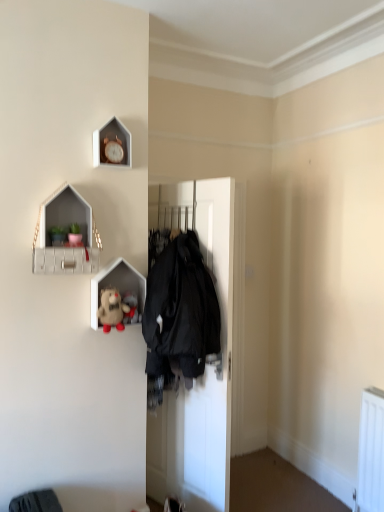
Question: Does fluffy beige teddy bear at upper left, the 2th toy from the back, have a lesser width compared to matte white plush toy at center, placed as the second shelf when sorted from top to bottom?

Choices:
 (A) no
 (B) yes

Answer: (A)

Question: Is matte white plush toy at center, placed as the second shelf when sorted from top to bottom, surrounded by fluffy beige teddy bear at upper left, the 2th toy from the back?

Choices:
 (A) no
 (B) yes

Answer: (A)

Question: Is fluffy beige teddy bear at upper left, the 2th toy from the back, positioned beyond the bounds of matte white plush toy at center, placed as the second shelf when sorted from top to bottom?

Choices:
 (A) yes
 (B) no

Answer: (B)

Question: From a real-world perspective, is fluffy beige teddy bear at upper left, which is the first toy in front-to-back order, physically below matte white plush toy at center, placed as the second shelf when sorted from top to bottom?

Choices:
 (A) yes
 (B) no

Answer: (A)

Question: Can you confirm if fluffy beige teddy bear at upper left, the 2th toy from the back, is shorter than matte white plush toy at center, positioned as the first shelf in bottom-to-top order?

Choices:
 (A) no
 (B) yes

Answer: (B)

Question: Do you think black matte coat hanger at center is within wooden clock at upper center, or outside of it?

Choices:
 (A) outside
 (B) inside

Answer: (A)

Question: Is black matte coat hanger at center in front of or behind wooden clock at upper center in the image?

Choices:
 (A) front
 (B) behind

Answer: (B)

Question: Visually, is black matte coat hanger at center positioned to the left or to the right of wooden clock at upper center?

Choices:
 (A) right
 (B) left

Answer: (A)

Question: Considering the positions of point (180, 446) and point (122, 148), is point (180, 446) closer or farther from the camera than point (122, 148)?

Choices:
 (A) closer
 (B) farther

Answer: (B)

Question: Considering their positions, is wooden clock at upper center located in front of or behind matte white plush toy at center, positioned as the first shelf in bottom-to-top order?

Choices:
 (A) behind
 (B) front

Answer: (B)

Question: From the image's perspective, relative to matte white plush toy at center, placed as the second shelf when sorted from top to bottom, is wooden clock at upper center above or below?

Choices:
 (A) below
 (B) above

Answer: (B)

Question: Is point (115, 163) closer or farther from the camera than point (144, 275)?

Choices:
 (A) farther
 (B) closer

Answer: (B)

Question: From a real-world perspective, is wooden clock at upper center physically located above or below matte white plush toy at center, placed as the second shelf when sorted from top to bottom?

Choices:
 (A) below
 (B) above

Answer: (B)

Question: Based on their sizes in the image, would you say fluffy beige teddy bear at upper left, which is the first toy in front-to-back order, is bigger or smaller than black matte coat hanger at center?

Choices:
 (A) small
 (B) big

Answer: (A)

Question: Is point (127, 312) closer or farther from the camera than point (195, 407)?

Choices:
 (A) closer
 (B) farther

Answer: (A)